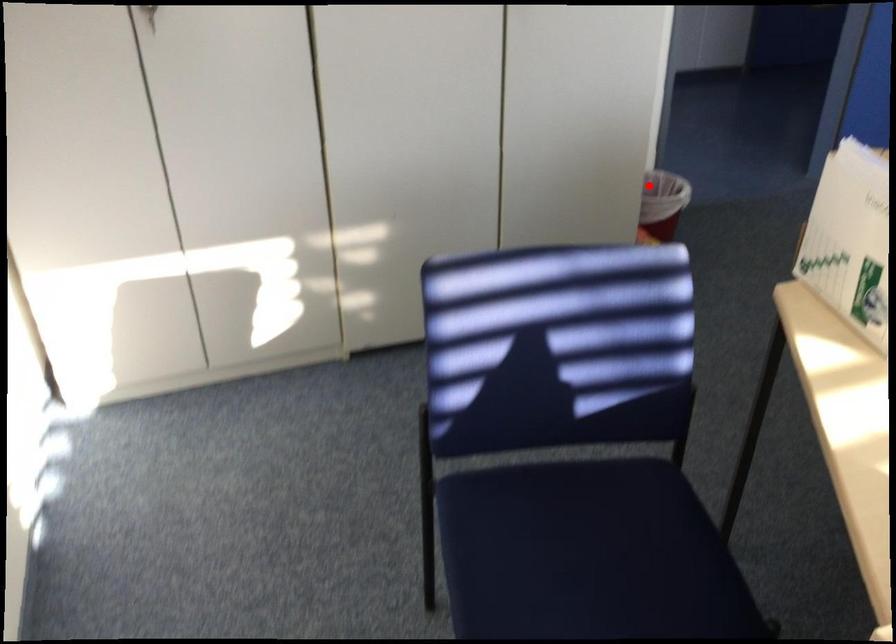
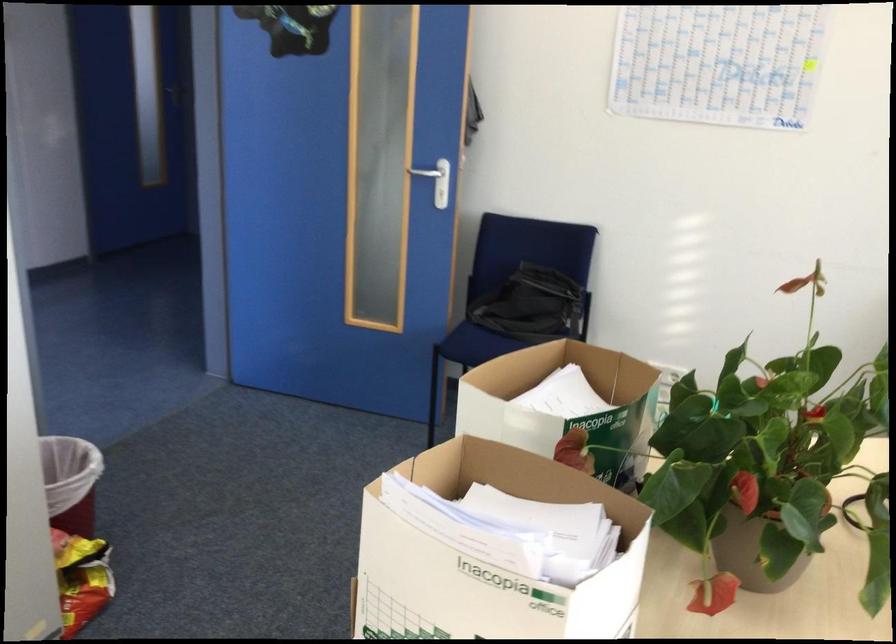
The point at the highlighted location is marked in the first image. Where is the corresponding point in the second image?

(71, 482)